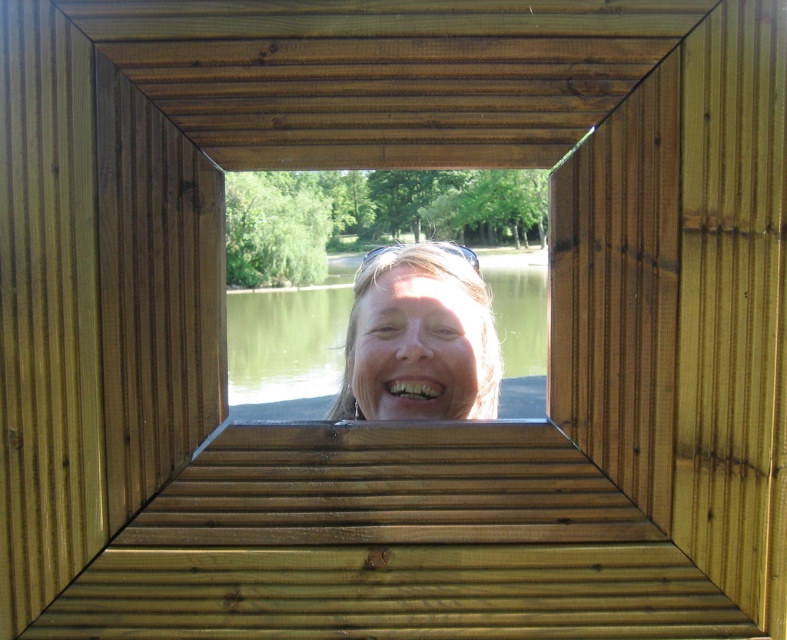
How far apart are green water at center and matte skin face at center?

They are 5.93 inches apart.

Between green water at center and matte skin face at center, which one has more height?

With more height is green water at center.

Image resolution: width=787 pixels, height=640 pixels. What do you see at coordinates (285, 352) in the screenshot? I see `green water at center` at bounding box center [285, 352].

The height and width of the screenshot is (640, 787). In order to click on green water at center in this screenshot , I will do `click(285, 352)`.